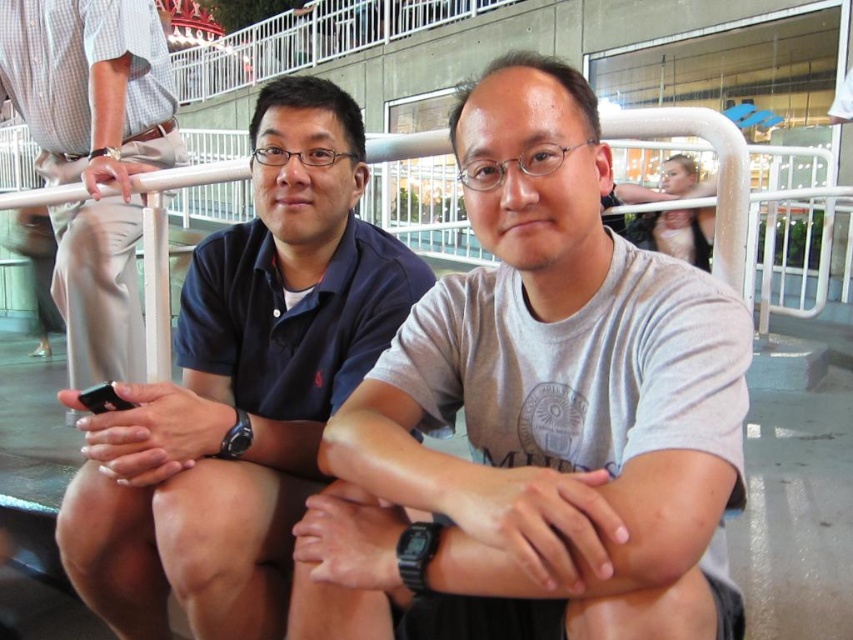
Identify the location of dark blue shirt at left. (242, 388).

Is dark blue shirt at left wider than light brown fabric pants at left?

Incorrect, dark blue shirt at left's width does not surpass light brown fabric pants at left's.

Between point (347, 355) and point (48, 92), which one is positioned in front?

Point (347, 355)

Identify the location of dark blue shirt at left. (242, 388).

Who is more distant from viewer, (506, 234) or (91, 36)?

The point (91, 36) is behind.

Image resolution: width=853 pixels, height=640 pixels. I want to click on gray cotton t-shirt at center, so click(x=537, y=416).

Locate an element on the screen. The width and height of the screenshot is (853, 640). gray cotton t-shirt at center is located at coordinates (537, 416).

Does light brown fabric pants at left have a greater width compared to white metal rail at upper center?

Correct, the width of light brown fabric pants at left exceeds that of white metal rail at upper center.

Does light brown fabric pants at left appear over white metal rail at upper center?

Yes, light brown fabric pants at left is above white metal rail at upper center.

Is point (79, 173) positioned behind point (775, 161)?

No, (79, 173) is closer to viewer.

This screenshot has width=853, height=640. Identify the location of light brown fabric pants at left. (93, 156).